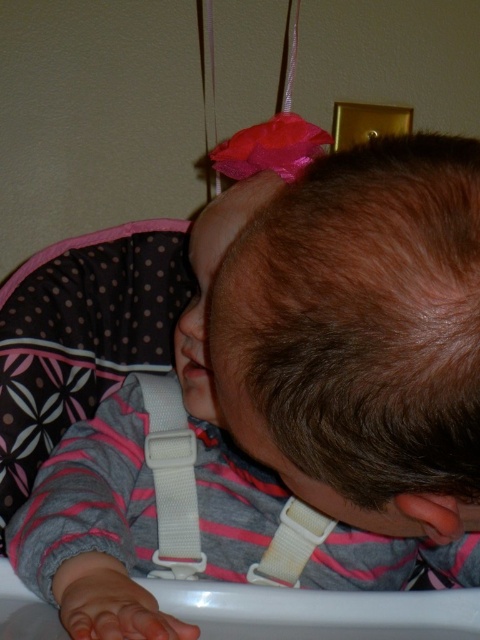
Question: Does brown matte hair at center have a smaller size compared to white fabric strap at center?

Choices:
 (A) no
 (B) yes

Answer: (A)

Question: Is brown matte hair at center bigger than white fabric strap at center?

Choices:
 (A) no
 (B) yes

Answer: (B)

Question: Among these points, which one is nearest to the camera?

Choices:
 (A) (389, 339)
 (B) (157, 388)

Answer: (A)

Question: Considering the relative positions of brown matte hair at center and white fabric strap at center in the image provided, where is brown matte hair at center located with respect to white fabric strap at center?

Choices:
 (A) right
 (B) left

Answer: (A)

Question: Among these points, which one is nearest to the camera?

Choices:
 (A) [x=187, y=556]
 (B) [x=348, y=499]

Answer: (B)